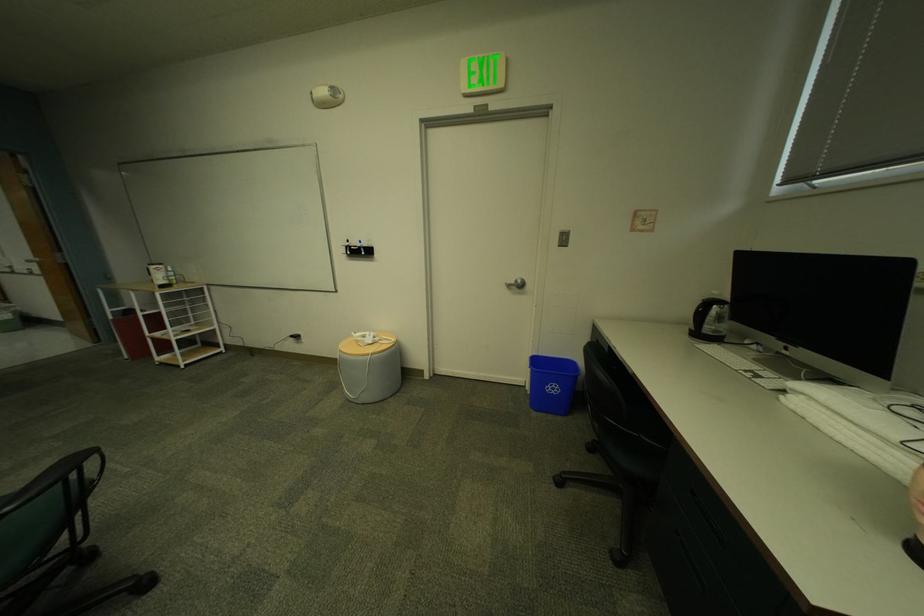
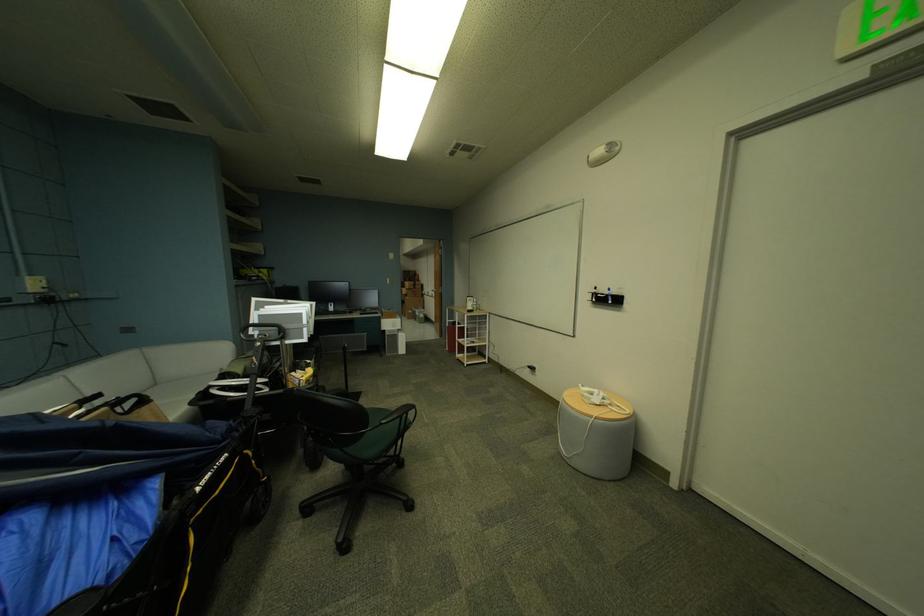
Locate, in the second image, the point that corresponds to (x=372, y=342) in the first image.

(599, 400)